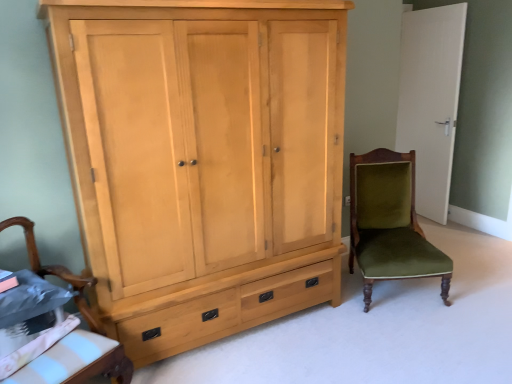
Question: Can we say white matte door at upper right lies outside velvet green chair at right, the first chair when ordered from right to left?

Choices:
 (A) no
 (B) yes

Answer: (B)

Question: From a real-world perspective, is white matte door at upper right over velvet green chair at right, the 1th chair positioned from the back?

Choices:
 (A) yes
 (B) no

Answer: (A)

Question: Does white matte door at upper right have a smaller size compared to velvet green chair at right, the 1th chair positioned from the back?

Choices:
 (A) yes
 (B) no

Answer: (A)

Question: From the image's perspective, would you say white matte door at upper right is positioned over velvet green chair at right, the 1th chair positioned from the back?

Choices:
 (A) no
 (B) yes

Answer: (B)

Question: Is white matte door at upper right closer to the viewer compared to velvet green chair at right, the 2th chair positioned from the front?

Choices:
 (A) no
 (B) yes

Answer: (A)

Question: From a real-world perspective, is velvet green chair at right, the 2th chair positioned from the front, above or below white matte door at upper right?

Choices:
 (A) below
 (B) above

Answer: (A)

Question: Which is correct: velvet green chair at right, the first chair when ordered from right to left, is inside white matte door at upper right, or outside of it?

Choices:
 (A) outside
 (B) inside

Answer: (A)

Question: Relative to white matte door at upper right, is velvet green chair at right, the 1th chair positioned from the back, in front or behind?

Choices:
 (A) behind
 (B) front

Answer: (B)

Question: Is velvet green chair at right, the first chair when ordered from right to left, taller or shorter than white matte door at upper right?

Choices:
 (A) tall
 (B) short

Answer: (B)

Question: In terms of size, does white matte door at upper right appear bigger or smaller than wooden armchair at lower left, which is the first chair in left-to-right order?

Choices:
 (A) small
 (B) big

Answer: (A)

Question: Is point (432, 218) closer or farther from the camera than point (78, 302)?

Choices:
 (A) closer
 (B) farther

Answer: (B)

Question: Based on their positions, is white matte door at upper right located to the left or right of wooden armchair at lower left, the 2th chair in the right-to-left sequence?

Choices:
 (A) right
 (B) left

Answer: (A)

Question: From a real-world perspective, is white matte door at upper right positioned above or below wooden armchair at lower left, the 2th chair in the right-to-left sequence?

Choices:
 (A) below
 (B) above

Answer: (B)

Question: Would you say light wood wardrobe at left is inside or outside velvet green chair at right, placed as the second chair when sorted from left to right?

Choices:
 (A) outside
 (B) inside

Answer: (A)

Question: Based on their sizes in the image, would you say light wood wardrobe at left is bigger or smaller than velvet green chair at right, the 2th chair positioned from the front?

Choices:
 (A) big
 (B) small

Answer: (A)